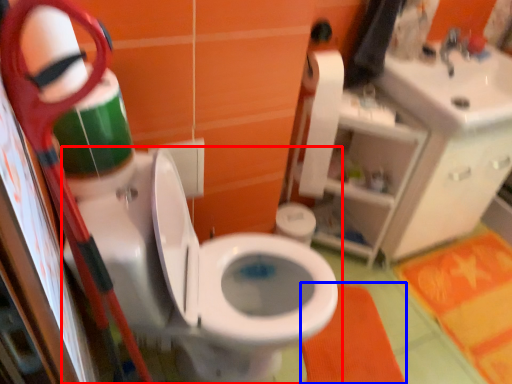
Question: Among these objects, which one is nearest to the camera, toilet (highlighted by a red box) or bath mat (highlighted by a blue box)?

Choices:
 (A) toilet
 (B) bath mat

Answer: (A)